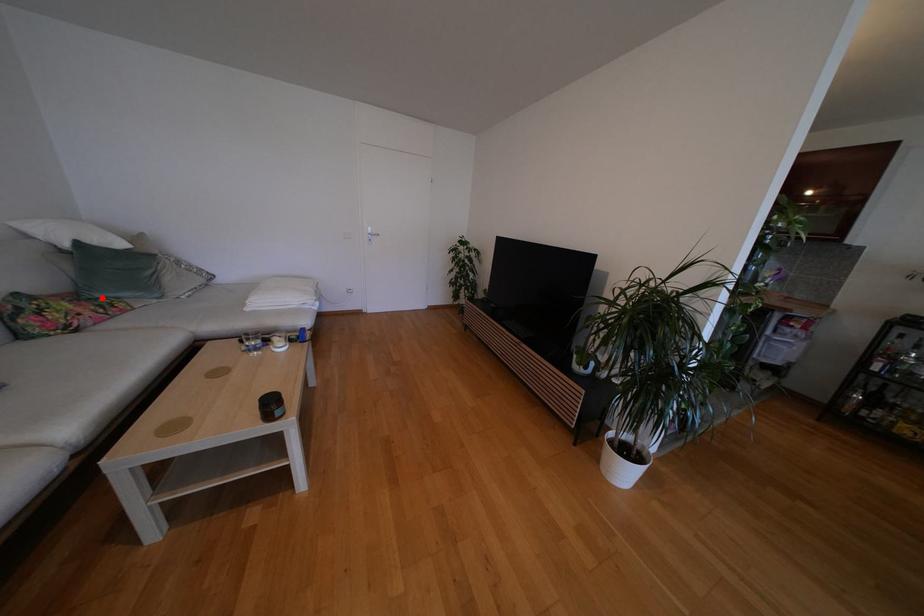
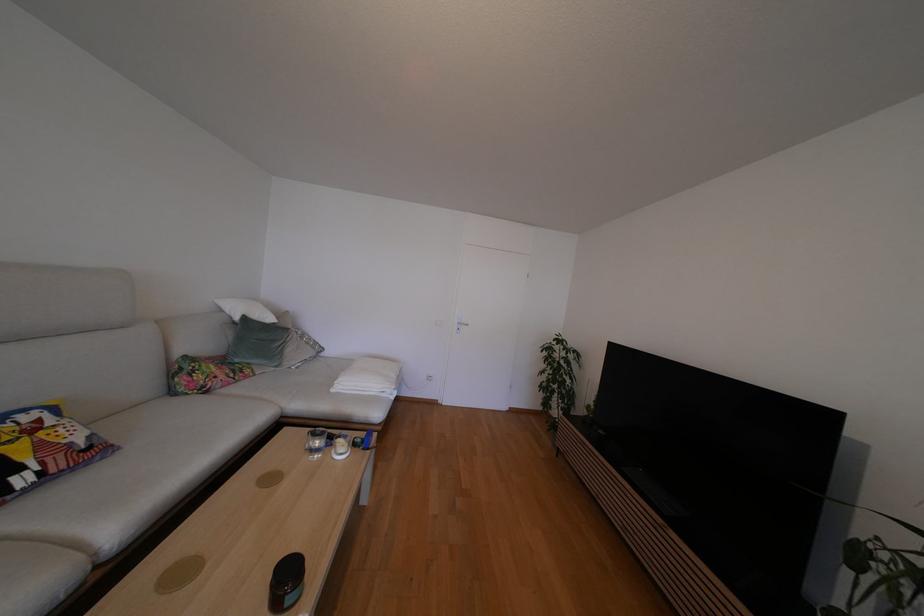
Find the pixel in the second image that matches the highlighted location in the first image.

(241, 363)